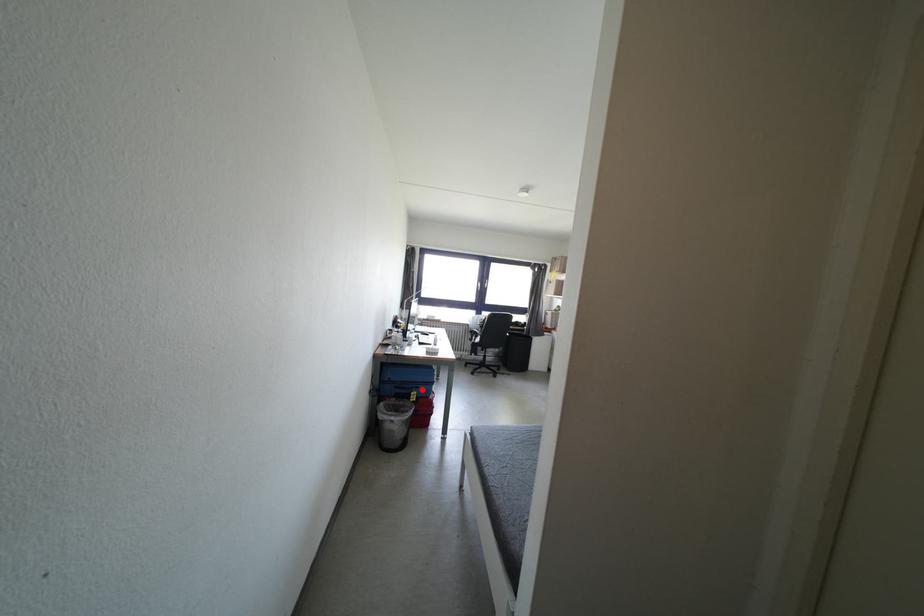
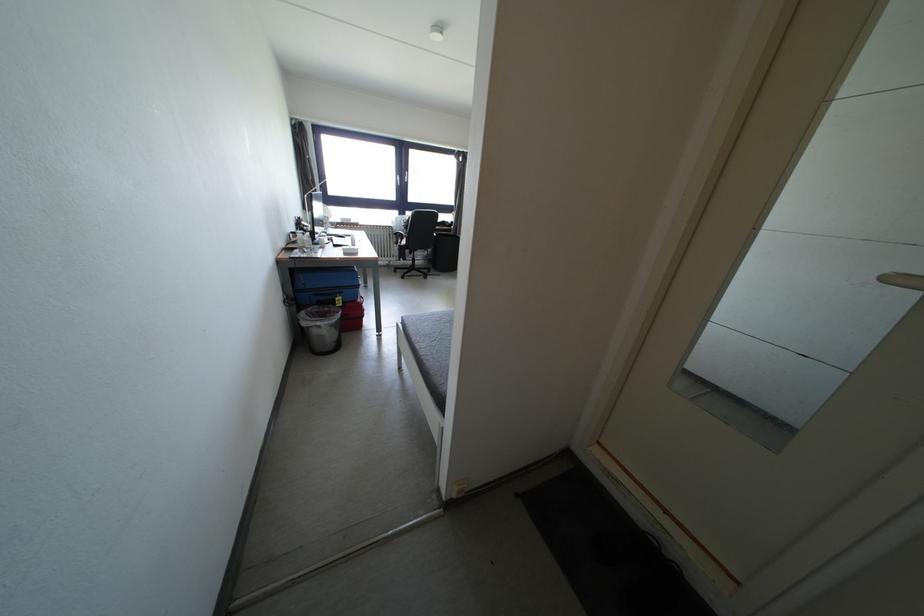
Where in the second image is the point corresponding to the highlighted location from the first image?

(345, 294)